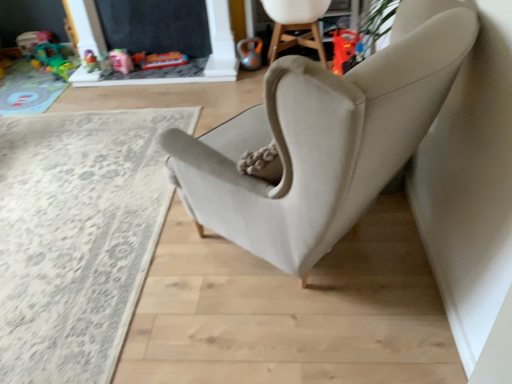
The image size is (512, 384). I want to click on free space to the left of translucent plastic toy at upper left, which is the fourth toy from right to left, so click(x=19, y=66).